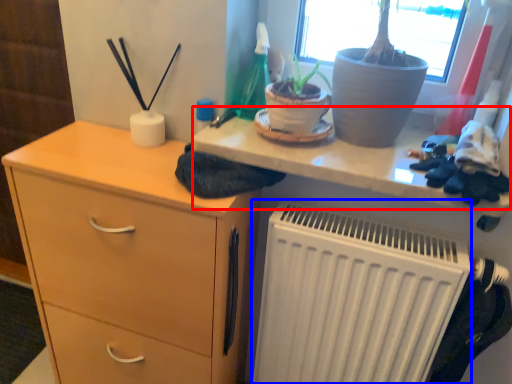
Question: Among these objects, which one is farthest to the camera, writing desk (highlighted by a red box) or radiator (highlighted by a blue box)?

Choices:
 (A) writing desk
 (B) radiator

Answer: (B)